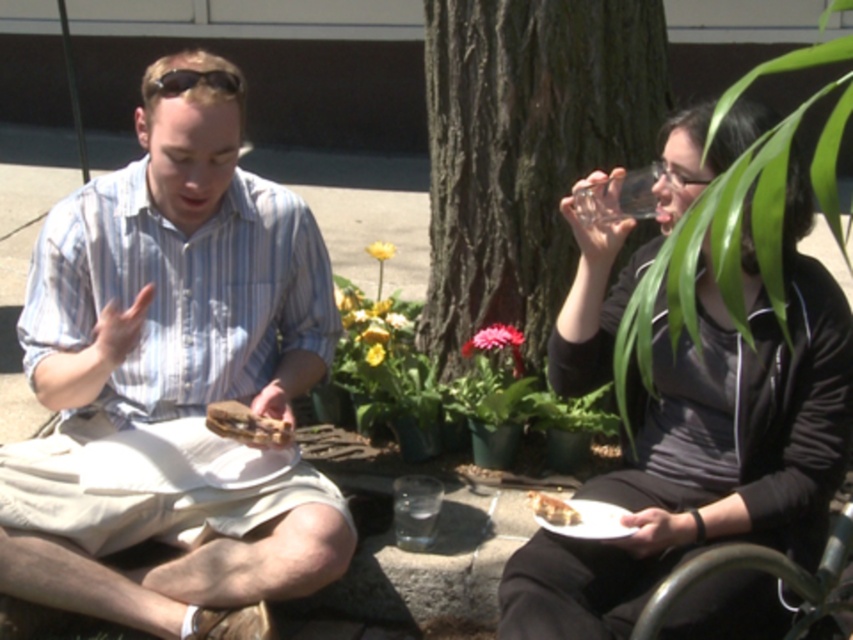
Question: Does dark brown bark tree at center have a lesser width compared to transparent glass at upper right?

Choices:
 (A) no
 (B) yes

Answer: (A)

Question: Can you confirm if matte black sunglasses at upper center is wider than crumbly brown bread at lower center?

Choices:
 (A) yes
 (B) no

Answer: (A)

Question: Estimate the real-world distances between objects in this image. Which object is closer to the matte brown sandwich at center?

Choices:
 (A) transparent glass at upper right
 (B) crumbly brown bread at lower center
 (C) matte black jacket at center

Answer: (B)

Question: Which object is the farthest from the matte black sunglasses at upper center?

Choices:
 (A) matte black jacket at center
 (B) transparent glass at upper right
 (C) matte brown sandwich at center
 (D) crumbly brown bread at lower center

Answer: (A)

Question: Is transparent glass at upper right below matte brown sandwich at center?

Choices:
 (A) no
 (B) yes

Answer: (A)

Question: Which object is the closest to the clear glass water at lower center?

Choices:
 (A) matte black sunglasses at upper center
 (B) matte brown sandwich at center
 (C) matte white shorts at center

Answer: (B)